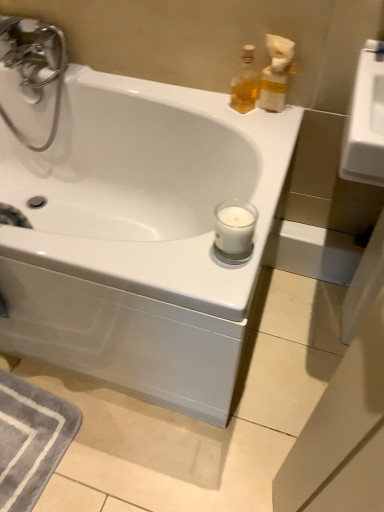
The image size is (384, 512). In order to click on unoccupied area in front of translucent glass bottle at upper right, placed as the 2th soap dispenser when sorted from right to left in this screenshot , I will do `click(259, 129)`.